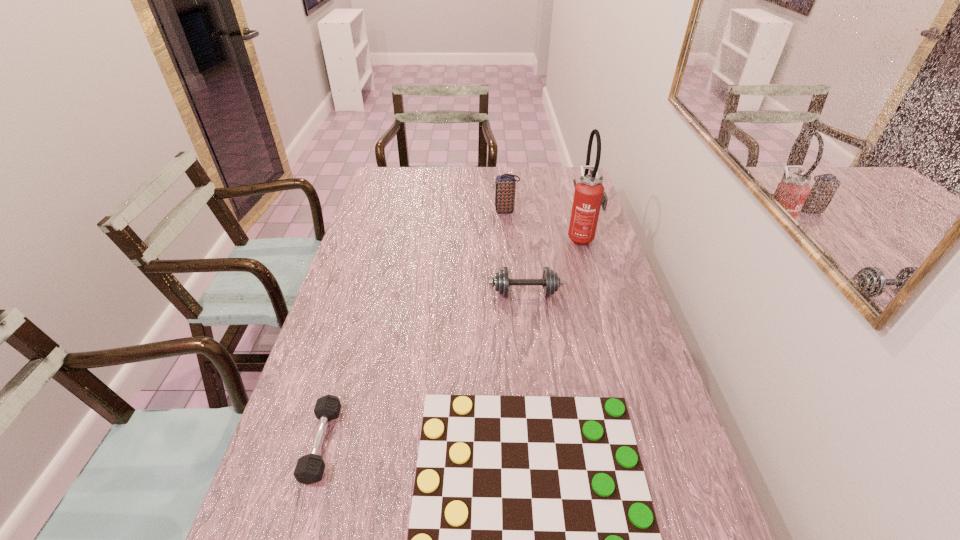
The width and height of the screenshot is (960, 540). What are the coordinates of `vacant space positioned at the nozzle of the second farthest object` in the screenshot? It's located at (544, 237).

Locate an element on the screen. vacant position located with the zip open on the clutch bag is located at coordinates (454, 211).

Locate an element on the screen. This screenshot has height=540, width=960. vacant region located 0.300m with the zip open on the clutch bag is located at coordinates (416, 211).

This screenshot has height=540, width=960. In order to click on vacant space located with the zip open on the clutch bag in this screenshot , I will do `click(419, 211)`.

Find the location of a particular element. The width and height of the screenshot is (960, 540). blank space located 0.050m on the right of the third farthest object is located at coordinates (577, 293).

The width and height of the screenshot is (960, 540). Find the location of `vacant region located on the right of the nearer dumbbell`. vacant region located on the right of the nearer dumbbell is located at coordinates (404, 443).

This screenshot has width=960, height=540. Find the location of `object that is at the left edge`. object that is at the left edge is located at coordinates (309, 469).

You are a GUI agent. You are given a task and a screenshot of the screen. Output one action in this format:
    pyautogui.click(x=<x>, y=<y>)
    Task: Click on the object at the right edge
    The image size is (960, 540).
    Given the screenshot: What is the action you would take?
    pyautogui.click(x=589, y=196)

You are a GUI agent. You are given a task and a screenshot of the screen. Output one action in this format:
    pyautogui.click(x=<x>, y=<y>)
    Task: Click on the free region at the far edge
    This screenshot has width=960, height=540.
    Given the screenshot: What is the action you would take?
    coord(471,193)

In the image, there is a desktop. Find the location of `vacant space at the left edge`. vacant space at the left edge is located at coordinates (363, 287).